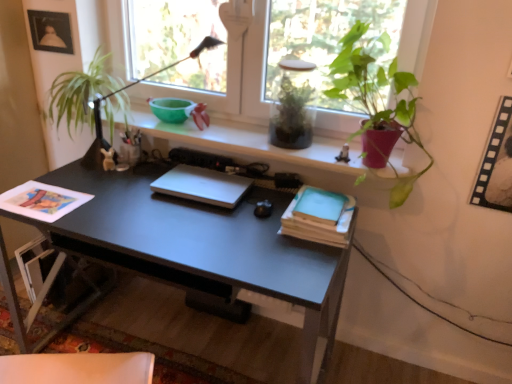
This screenshot has height=384, width=512. I want to click on free spot above white matte laptop at center (from a real-world perspective), so click(x=201, y=184).